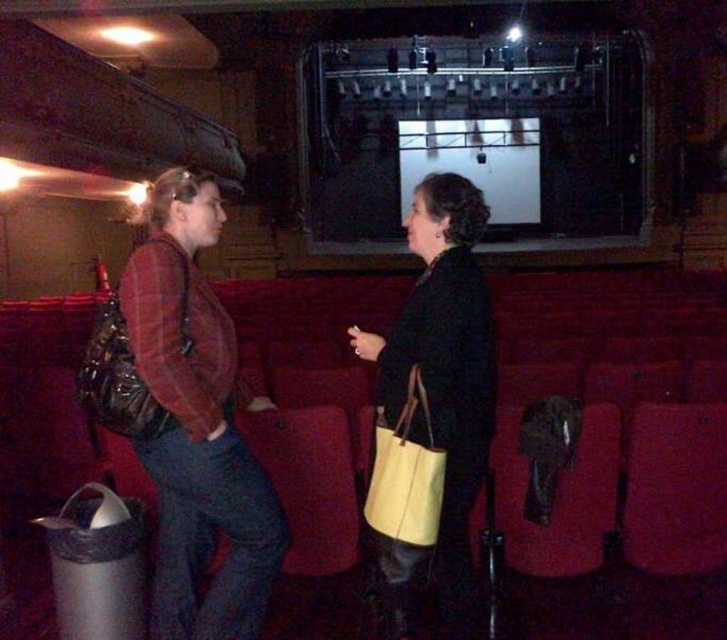
Question: Estimate the real-world distances between objects in this image. Which object is closer to the matte yellow tote bag at center?

Choices:
 (A) plaid fabric jacket at left
 (B) yellow fabric tote at center

Answer: (B)

Question: Observing the image, what is the correct spatial positioning of plaid fabric jacket at left in reference to matte yellow tote bag at center?

Choices:
 (A) left
 (B) right

Answer: (A)

Question: Is matte yellow tote bag at center to the right of yellow fabric tote at center from the viewer's perspective?

Choices:
 (A) no
 (B) yes

Answer: (B)

Question: Where is plaid fabric jacket at left located in relation to matte yellow tote bag at center in the image?

Choices:
 (A) left
 (B) right

Answer: (A)

Question: Which object is farther from the camera taking this photo?

Choices:
 (A) yellow fabric tote at center
 (B) matte yellow tote bag at center

Answer: (B)

Question: Which of the following is the farthest from the observer?

Choices:
 (A) click(451, 289)
 (B) click(437, 518)
 (C) click(161, 472)

Answer: (B)